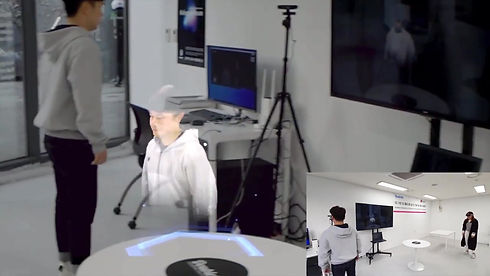
The width and height of the screenshot is (490, 276). What are the coordinates of `white circular desk` in the screenshot? It's located at (417, 265).